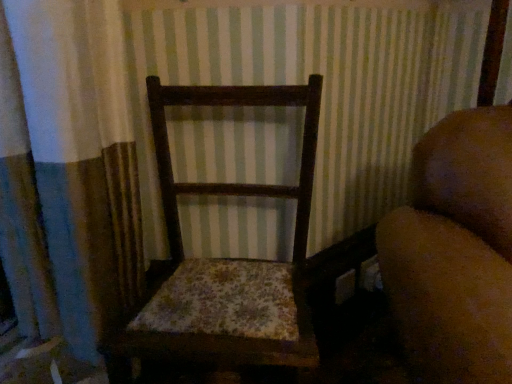
Question: Is brown fuzzy couch at right closer to the viewer compared to wooden floral cushioned chair at center?

Choices:
 (A) yes
 (B) no

Answer: (A)

Question: Is brown fuzzy couch at right bigger than wooden floral cushioned chair at center?

Choices:
 (A) no
 (B) yes

Answer: (B)

Question: Is brown fuzzy couch at right in contact with wooden floral cushioned chair at center?

Choices:
 (A) yes
 (B) no

Answer: (B)

Question: Is brown fuzzy couch at right thinner than wooden floral cushioned chair at center?

Choices:
 (A) yes
 (B) no

Answer: (B)

Question: Are brown fuzzy couch at right and wooden floral cushioned chair at center far apart?

Choices:
 (A) no
 (B) yes

Answer: (A)

Question: From the image's perspective, is brown fuzzy couch at right located above wooden floral cushioned chair at center?

Choices:
 (A) no
 (B) yes

Answer: (A)

Question: Is wooden floral cushioned chair at center positioned far away from brown fuzzy couch at right?

Choices:
 (A) yes
 (B) no

Answer: (B)

Question: From a real-world perspective, is wooden floral cushioned chair at center located higher than brown fuzzy couch at right?

Choices:
 (A) yes
 (B) no

Answer: (B)

Question: Can you confirm if wooden floral cushioned chair at center is taller than brown fuzzy couch at right?

Choices:
 (A) no
 (B) yes

Answer: (A)

Question: Can you confirm if wooden floral cushioned chair at center is shorter than brown fuzzy couch at right?

Choices:
 (A) no
 (B) yes

Answer: (B)

Question: Is wooden floral cushioned chair at center closer to the viewer compared to brown fuzzy couch at right?

Choices:
 (A) yes
 (B) no

Answer: (B)

Question: From the image's perspective, is wooden floral cushioned chair at center located beneath brown fuzzy couch at right?

Choices:
 (A) no
 (B) yes

Answer: (A)

Question: Does point (276, 92) appear closer or farther from the camera than point (505, 193)?

Choices:
 (A) closer
 (B) farther

Answer: (B)